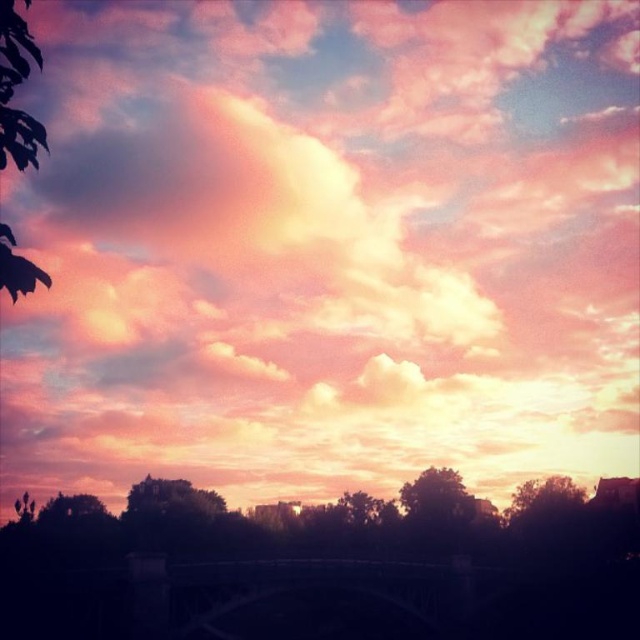
You are an architect designing a new park and want to place two trees in the same style as the green leafy tree at left and the silhouetted leafy tree at lower right. If you want to ensure they are arranged in the same spatial relationship as in the sunset scene, which tree should be placed higher in the design?

The green leafy tree at left should be placed higher than the silhouetted leafy tree at lower right to maintain the same spatial relationship as in the sunset scene.

You are standing in the park and see the silhouetted leafy tree at lower right and the silhouetted tree at center. Which tree is closer to you?

The silhouetted leafy tree at lower right is closer to the viewer than the silhouetted tree at center.

You are an artist trying to paint this sunset scene. You want to place the silhouetted leafy tree at lower right and the silhouetted tree at center in your painting. According to the image, which tree should you draw higher up in the painting?

The silhouetted leafy tree at lower right should be drawn higher up in the painting because it is positioned above the silhouetted tree at center.